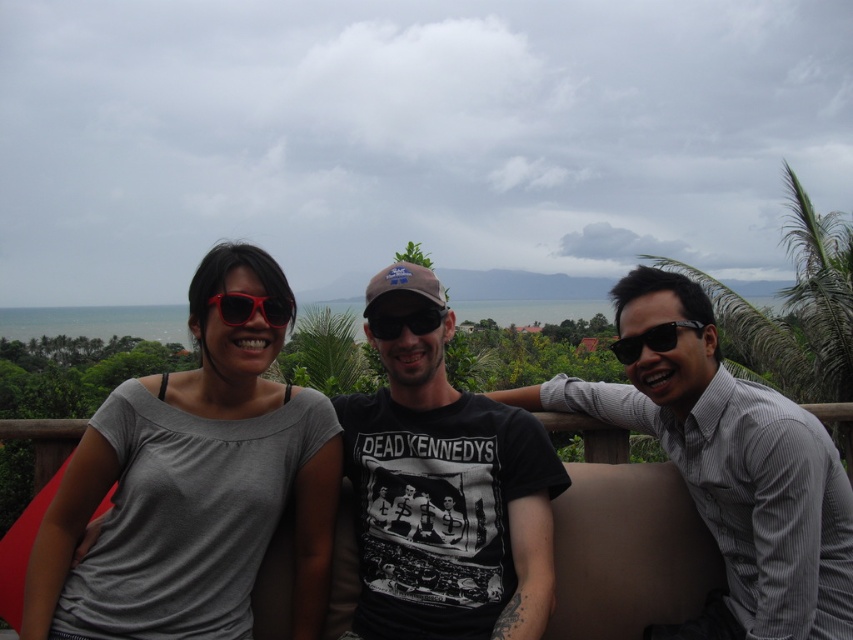
Question: Does matte gray shirt at center have a greater width compared to gray matte shirt at center?

Choices:
 (A) yes
 (B) no

Answer: (A)

Question: Which point is farther to the camera?

Choices:
 (A) (225, 308)
 (B) (618, 346)

Answer: (B)

Question: Can you confirm if matte gray shirt at center is smaller than gray matte shirt at center?

Choices:
 (A) yes
 (B) no

Answer: (B)

Question: Which object is farther from the camera taking this photo?

Choices:
 (A) matte gray shirt at center
 (B) black plastic sunglasses at right
 (C) black cotton t-shirt at center
 (D) black matte sunglasses at center

Answer: (D)

Question: Where is black cotton t-shirt at center located in relation to black plastic sunglasses at right in the image?

Choices:
 (A) left
 (B) right

Answer: (A)

Question: Estimate the real-world distances between objects in this image. Which object is farther from the black matte sunglasses at center?

Choices:
 (A) matte black sunglasses at left
 (B) black cotton t-shirt at center

Answer: (A)